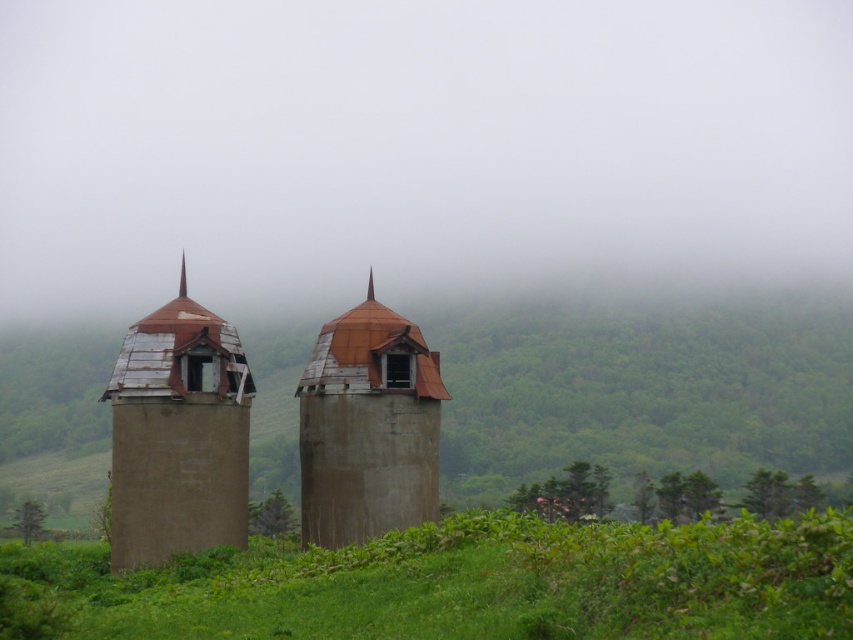
Question: Considering the real-world distances, which object is farthest from the rusty metal tower at left?

Choices:
 (A) foggy sky at center
 (B) green grassy at lower center

Answer: (A)

Question: Does foggy sky at center lie behind green grassy at lower center?

Choices:
 (A) no
 (B) yes

Answer: (B)

Question: Which point appears closest to the camera in this image?

Choices:
 (A) (491, 17)
 (B) (358, 378)

Answer: (B)

Question: Is foggy sky at center wider than rusty metal tower at left?

Choices:
 (A) no
 (B) yes

Answer: (B)

Question: Considering the relative positions of foggy sky at center and rusty concrete towers at center in the image provided, where is foggy sky at center located with respect to rusty concrete towers at center?

Choices:
 (A) left
 (B) right

Answer: (A)

Question: Estimate the real-world distances between objects in this image. Which object is closer to the foggy sky at center?

Choices:
 (A) rusty metal tower at left
 (B) green grassy at lower center
 (C) rusty metal tower at center

Answer: (C)